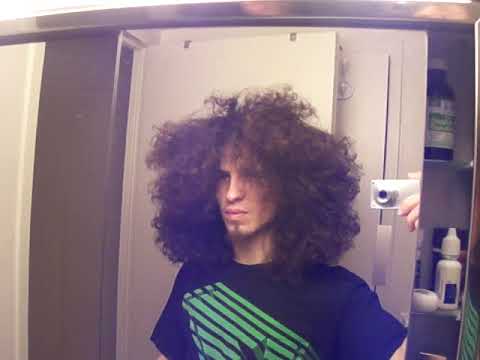
At what (x,y) coordinates should I click in order to perform the action: click on door frame. Please return your answer as a coordinate pair (x, y). Image resolution: width=480 pixels, height=360 pixels. Looking at the image, I should click on (33, 141).